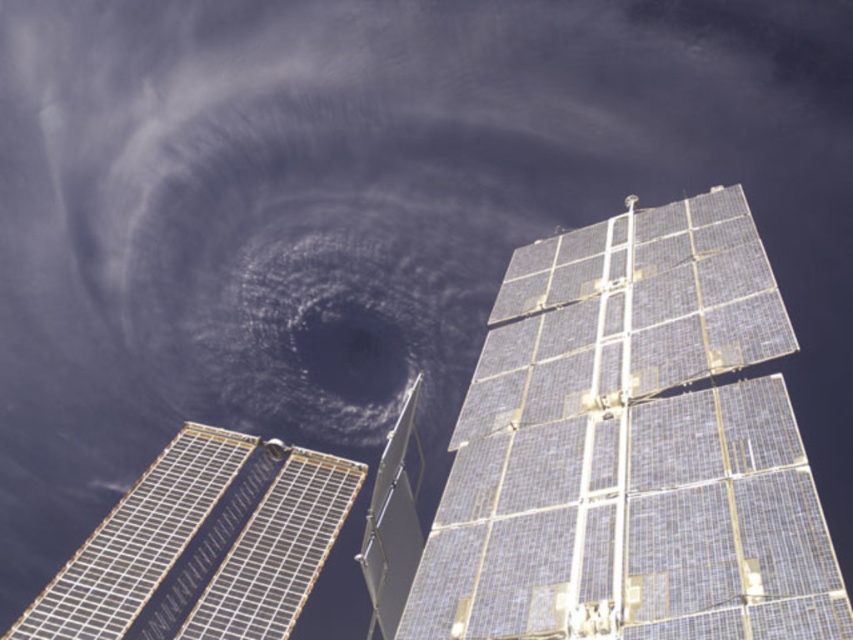
You are an astronaut floating near the spacecraft. You need to move from the silver metallic solar panel at lower left to the blue metallic solar panel at upper right. Which direction should you move relative to the spacecraft?

You should move to the right relative to the spacecraft because the blue metallic solar panel at upper right is positioned to the right of the silver metallic solar panel at lower left.

You are an astronaut floating near the spacecraft. You need to reach the silver metallic solar panel at lower left but must avoid the Earth storm clouds in the background. Since the blue metallic solar panel at upper right is in your path, can you safely navigate around it to reach your destination?

The blue metallic solar panel at upper right is closer to the viewer than the silver metallic solar panel at lower left, so you can navigate around it to reach the silver metallic solar panel at lower left safely.